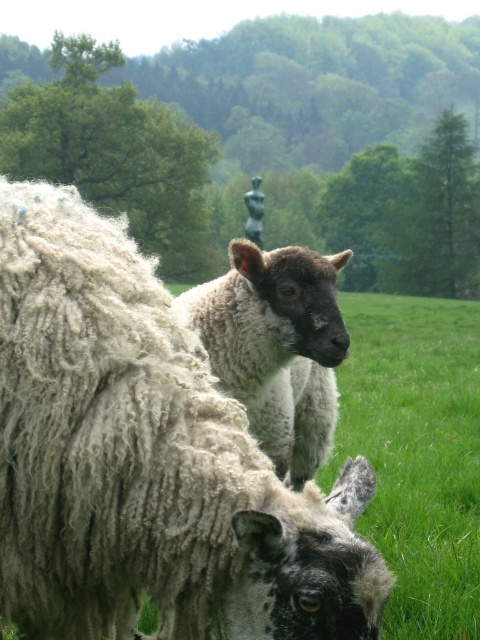
Who is positioned more to the left, curly woolen sheep at center or white woolen lamb at center?

From the viewer's perspective, curly woolen sheep at center appears more on the left side.

Describe the element at coordinates (146, 460) in the screenshot. Image resolution: width=480 pixels, height=640 pixels. I see `curly woolen sheep at center` at that location.

The image size is (480, 640). Find the location of `curly woolen sheep at center`. curly woolen sheep at center is located at coordinates (146, 460).